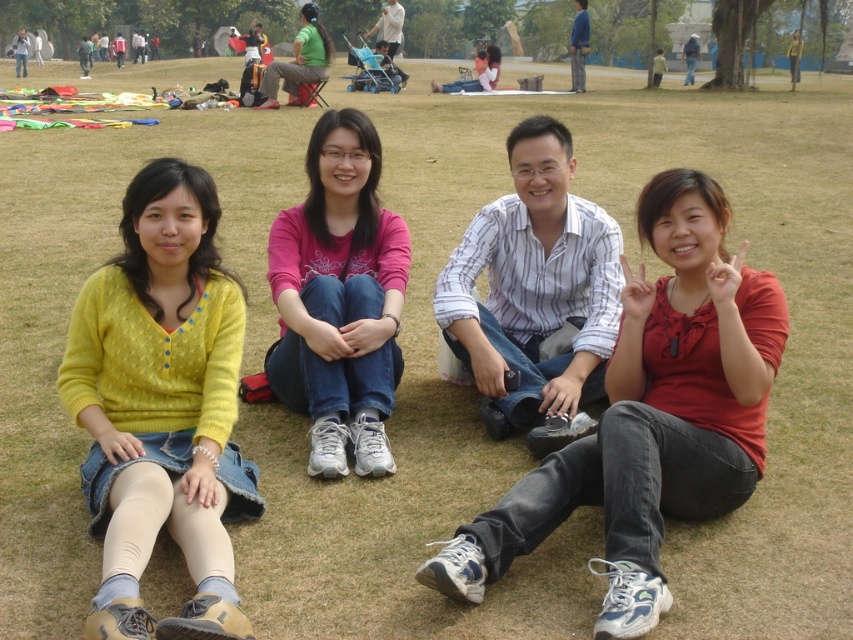
You are organizing a clothing donation drive and need to sort items by size. You have two shirts to sort, the matte red shirt at center and the green matte shirt at upper center. Which one should you place in the small size bin?

The matte red shirt at center is smaller than the green matte shirt at upper center, so it should be placed in the small size bin.

You are standing in the park and see the image. You want to find the matte red shirt at center. Where should you look?

The matte red shirt at center is located at the coordinates point (650, 416) in the image.